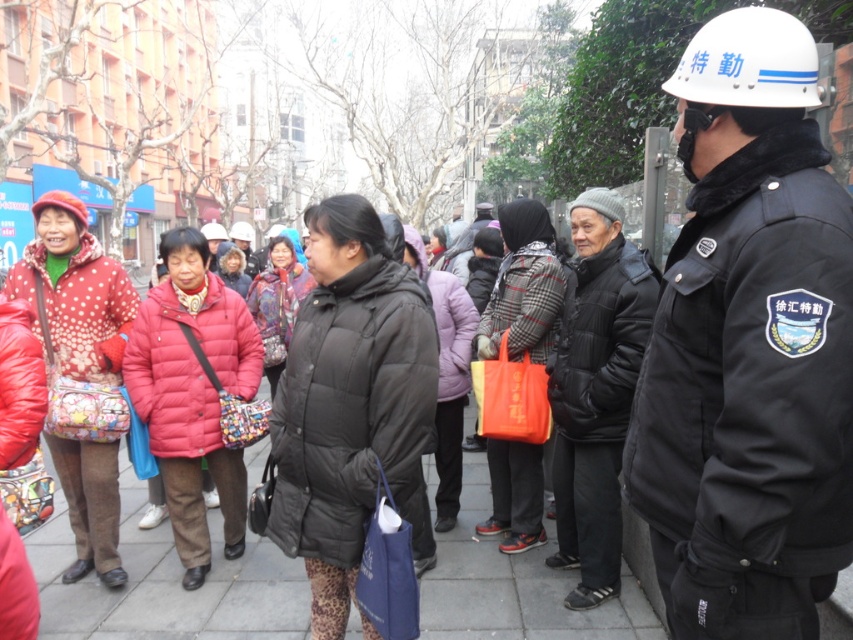
Question: Can you confirm if matte pink puffer jacket at center is positioned below plaid fabric jacket at center?

Choices:
 (A) no
 (B) yes

Answer: (B)

Question: Which is farther from the matte black coat at center?

Choices:
 (A) matte pink coat at center
 (B) matte pink puffer jacket at center

Answer: (B)

Question: Is black puffy coat at center to the right of matte black coat at center from the viewer's perspective?

Choices:
 (A) no
 (B) yes

Answer: (B)

Question: Which point is farther from the camera taking this photo?

Choices:
 (A) (786, 438)
 (B) (277, 364)

Answer: (B)

Question: Which object appears closest to the camera in this image?

Choices:
 (A) matte pink coat at center
 (B) plaid fabric jacket at center
 (C) white matte helmet at upper right
 (D) matte pink puffer jacket at center

Answer: (C)

Question: Where is matte black jacket at center located in relation to matte pink coat at center in the image?

Choices:
 (A) right
 (B) left

Answer: (A)